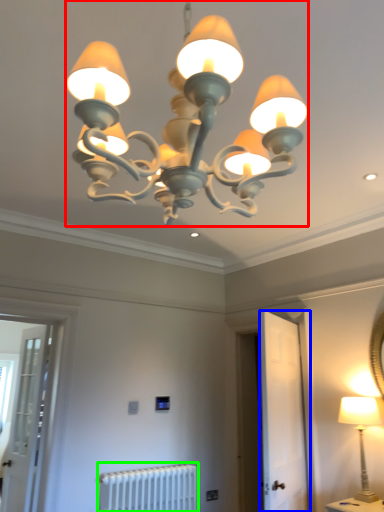
Question: Estimate the real-world distances between objects in this image. Which object is farther from lamp (highlighted by a red box), screen door (highlighted by a blue box) or radiator (highlighted by a green box)?

Choices:
 (A) screen door
 (B) radiator

Answer: (B)